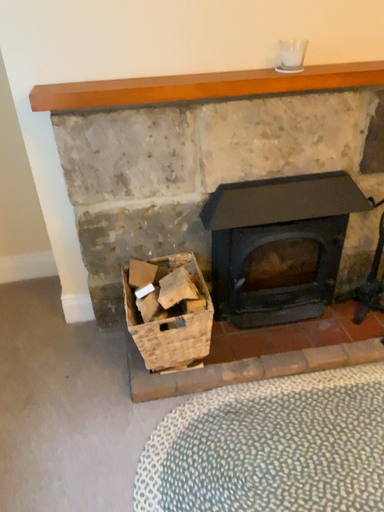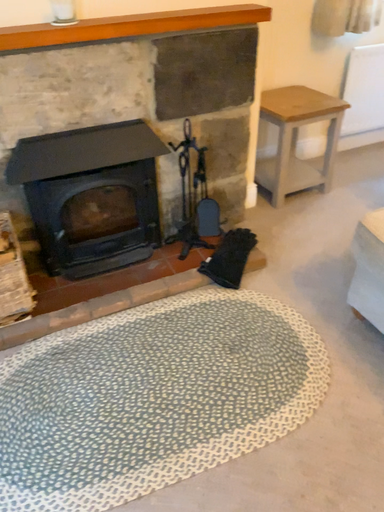
Question: How did the camera likely rotate when shooting the video?

Choices:
 (A) rotated right
 (B) rotated left

Answer: (A)